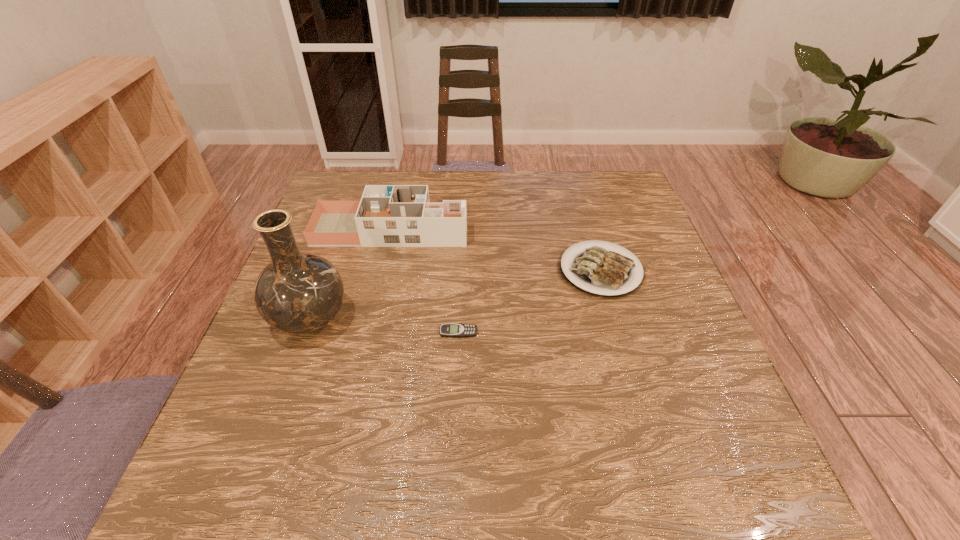
Where is `vase that is at the left edge`? The width and height of the screenshot is (960, 540). vase that is at the left edge is located at coordinates (297, 293).

Find the location of `dollhouse situated at the left edge`. dollhouse situated at the left edge is located at coordinates (387, 215).

In order to click on object at the right edge in this screenshot , I will do `click(601, 271)`.

The width and height of the screenshot is (960, 540). I want to click on object that is at the far left corner, so click(387, 215).

Find the location of a particular element. This screenshot has width=960, height=540. vacant space at the far edge of the desktop is located at coordinates (458, 176).

Image resolution: width=960 pixels, height=540 pixels. In the image, there is a desktop. Find the location of `vacant space at the near edge`. vacant space at the near edge is located at coordinates (387, 488).

This screenshot has height=540, width=960. In the image, there is a desktop. Identify the location of vacant region at the left edge. (326, 349).

This screenshot has width=960, height=540. I want to click on vacant space at the right edge of the desktop, so click(722, 446).

The width and height of the screenshot is (960, 540). Find the location of `vacant space at the far left corner`. vacant space at the far left corner is located at coordinates (331, 187).

Find the location of a particular element. The image size is (960, 540). vacant space at the far right corner is located at coordinates (625, 186).